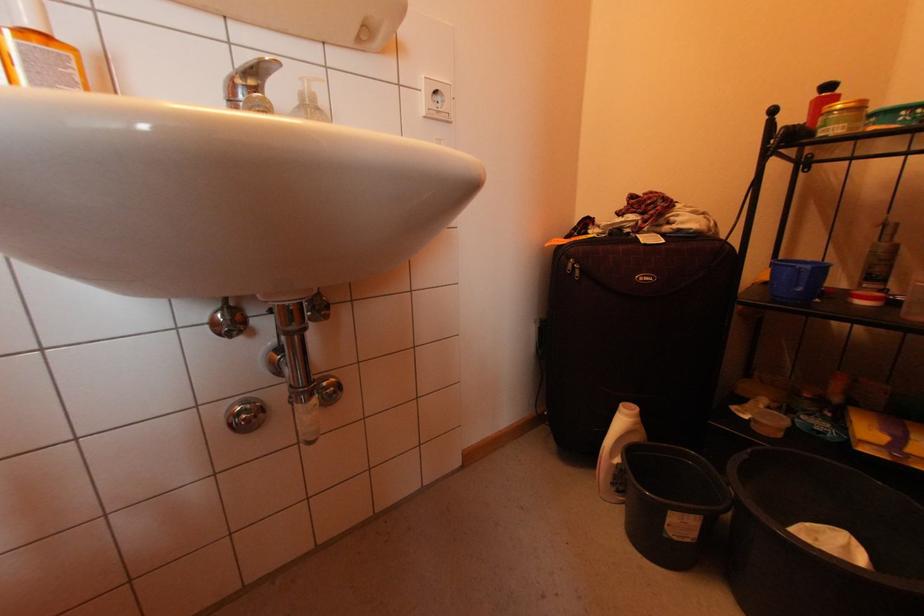
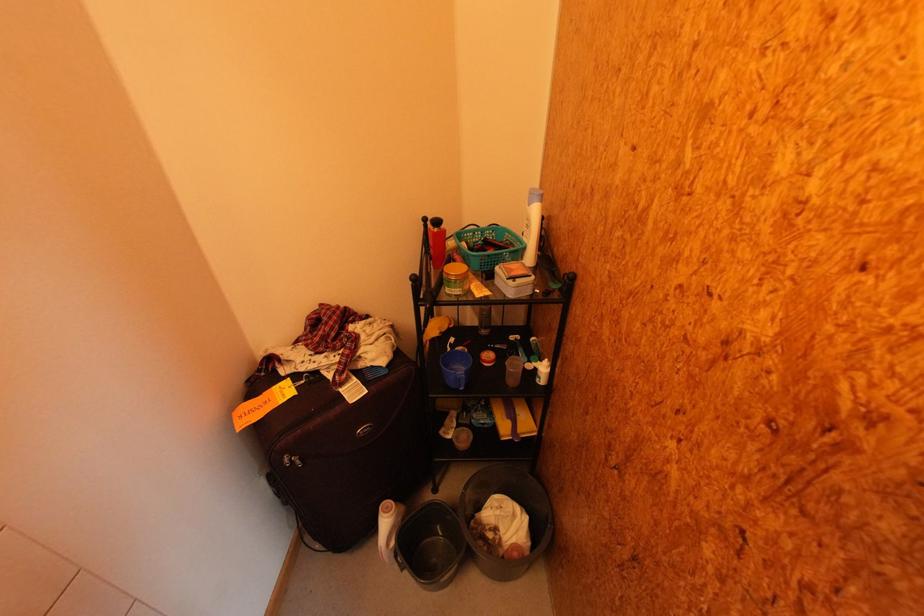
Find the pixel in the second image that matches pixel 845 126 in the first image.

(464, 291)